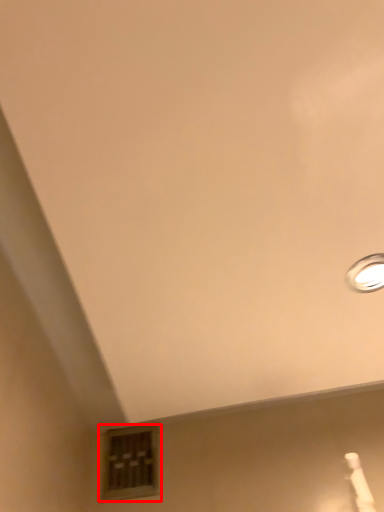
Question: From the image's perspective, what is the correct spatial relationship of window (annotated by the red box) in relation to lamp?

Choices:
 (A) above
 (B) below

Answer: (B)